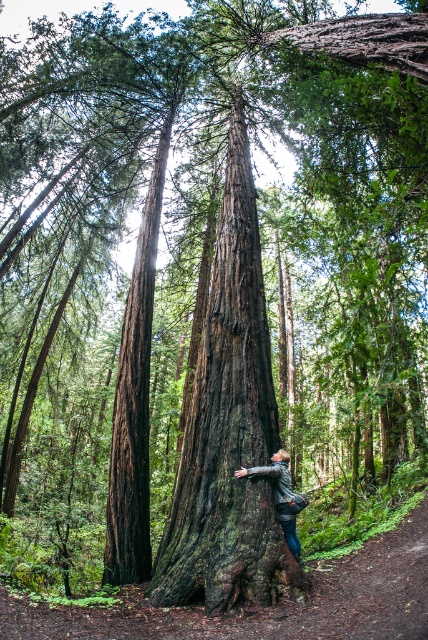
Can you confirm if dark brown rough bark at center is smaller than leather jacket at center?

No.

Identify the location of dark brown rough bark at center. The image size is (428, 640). (228, 428).

Based on the photo, does dark brown bark tree trunk at center appear under leather jacket at center?

No.

Consider the image. Can you confirm if dark brown bark tree trunk at center is shorter than leather jacket at center?

Correct, dark brown bark tree trunk at center is not as tall as leather jacket at center.

Is point (112, 532) farther from camera compared to point (282, 486)?

Yes.

Find the location of a particular element. dark brown bark tree trunk at center is located at coordinates (134, 397).

Between dark brown rough bark at center and dark brown bark tree trunk at center, which one appears on the right side from the viewer's perspective?

Positioned to the right is dark brown rough bark at center.

Does dark brown rough bark at center have a larger size compared to dark brown bark tree trunk at center?

Correct, dark brown rough bark at center is larger in size than dark brown bark tree trunk at center.

Who is more forward, (220, 308) or (109, 563)?

Point (109, 563)

Identify the location of dark brown rough bark at center. The image size is (428, 640). (228, 428).